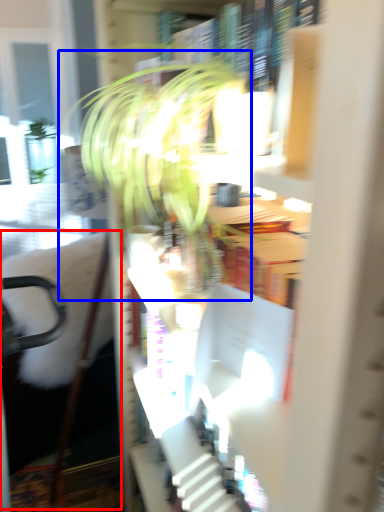
Question: Among these objects, which one is nearest to the camera, swivel chair (highlighted by a red box) or houseplant (highlighted by a blue box)?

Choices:
 (A) swivel chair
 (B) houseplant

Answer: (A)